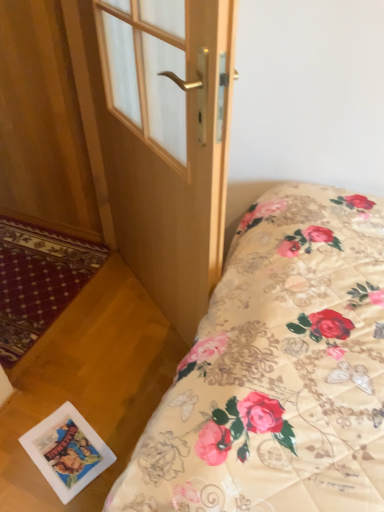
Describe the element at coordinates (168, 143) in the screenshot. I see `wooden door at center` at that location.

Locate an element on the screen. wooden door at center is located at coordinates 168,143.

What is the approximate height of wooden door at center?

wooden door at center is 1.29 meters in height.

Measure the distance between white glossy postcard at lower left and camera.

white glossy postcard at lower left is 1.34 meters away from camera.

The width and height of the screenshot is (384, 512). What do you see at coordinates (67, 451) in the screenshot? I see `white glossy postcard at lower left` at bounding box center [67, 451].

What is the approximate width of white glossy postcard at lower left?

It is 11.92 inches.

This screenshot has width=384, height=512. In order to click on white glossy postcard at lower left in this screenshot , I will do `click(67, 451)`.

Find the location of a particular element. The image size is (384, 512). wooden door at center is located at coordinates (168, 143).

Considering the relative positions of wooden door at center and white glossy postcard at lower left in the image provided, is wooden door at center to the left or to the right of white glossy postcard at lower left?

Based on their positions, wooden door at center is located to the right of white glossy postcard at lower left.

Does wooden door at center lie in front of white glossy postcard at lower left?

Yes, it is in front of white glossy postcard at lower left.

Is point (212, 45) positioned in front of point (62, 456)?

Yes, it is.

From the image's perspective, would you say wooden door at center is positioned over white glossy postcard at lower left?

Yes, from the image's perspective, wooden door at center is on top of white glossy postcard at lower left.

From a real-world perspective, who is located lower, wooden door at center or white glossy postcard at lower left?

white glossy postcard at lower left is physically lower.

Is wooden door at center thinner than white glossy postcard at lower left?

Yes.

In terms of height, does wooden door at center look taller or shorter compared to white glossy postcard at lower left?

Clearly, wooden door at center is taller compared to white glossy postcard at lower left.

Between wooden door at center and white glossy postcard at lower left, which one has larger size?

wooden door at center.

Would you say white glossy postcard at lower left is part of wooden door at center's contents?

No.

Is wooden door at center not near white glossy postcard at lower left?

No.

Is wooden door at center aimed at white glossy postcard at lower left?

Yes, wooden door at center faces towards white glossy postcard at lower left.

At what (x,y) coordinates should I click in order to perform the action: click on door located above the white glossy postcard at lower left (from a real-world perspective). Please return your answer as a coordinate pair (x, y). This screenshot has height=512, width=384. Looking at the image, I should click on (168, 143).

Does white glossy postcard at lower left appear on the right side of wooden door at center?

No.

Based on the photo, between white glossy postcard at lower left and wooden door at center, which one is positioned behind?

white glossy postcard at lower left is behind.

Does point (57, 463) appear closer or farther from the camera than point (118, 193)?

Point (57, 463).

From the image's perspective, which is below, white glossy postcard at lower left or wooden door at center?

white glossy postcard at lower left is shown below in the image.

Based on the photo, from a real-world perspective, is white glossy postcard at lower left on wooden door at center?

No, from a real-world perspective, white glossy postcard at lower left is not above wooden door at center.

Considering the relative sizes of white glossy postcard at lower left and wooden door at center in the image provided, is white glossy postcard at lower left thinner than wooden door at center?

Incorrect, the width of white glossy postcard at lower left is not less than that of wooden door at center.

Does white glossy postcard at lower left have a lesser height compared to wooden door at center?

Yes.

Considering the sizes of objects white glossy postcard at lower left and wooden door at center in the image provided, who is bigger, white glossy postcard at lower left or wooden door at center?

wooden door at center.

Is white glossy postcard at lower left inside or outside of wooden door at center?

white glossy postcard at lower left exists outside the volume of wooden door at center.

Is white glossy postcard at lower left directly adjacent to wooden door at center?

They are not placed beside each other.

Consider the image. Is white glossy postcard at lower left facing away from wooden door at center?

No, wooden door at center is not at the back of white glossy postcard at lower left.

Identify the location of door that is in front of the white glossy postcard at lower left. (168, 143).

Where is `postcard on the left side of wooden door at center`? The height and width of the screenshot is (512, 384). postcard on the left side of wooden door at center is located at coordinates (67, 451).

You are a GUI agent. You are given a task and a screenshot of the screen. Output one action in this format:
    pyautogui.click(x=<x>, y=<y>)
    Task: Click on the door on the right of white glossy postcard at lower left
    Image resolution: width=384 pixels, height=512 pixels.
    Given the screenshot: What is the action you would take?
    pyautogui.click(x=168, y=143)